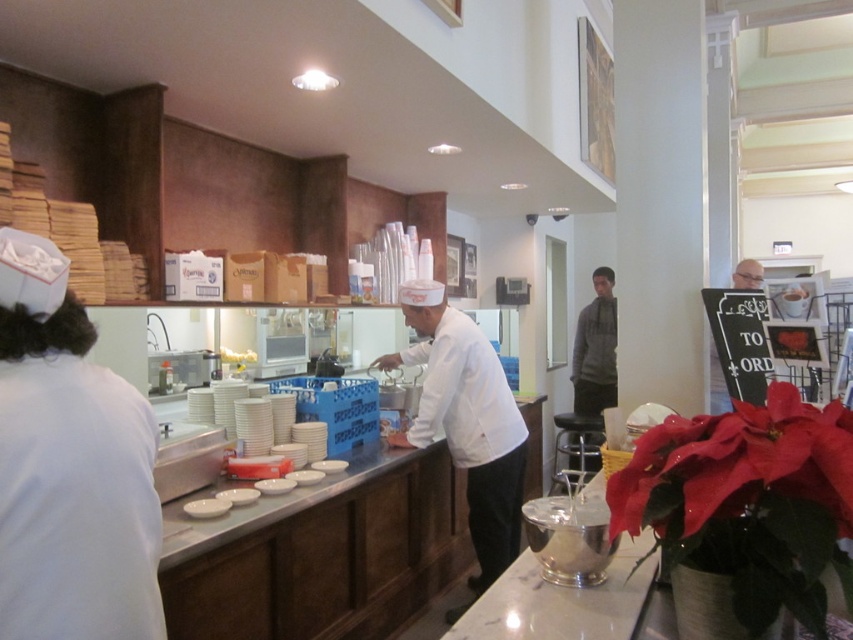
Question: Is white matte chef hat at center positioned at the back of white glossy counter at center?

Choices:
 (A) no
 (B) yes

Answer: (B)

Question: Does white glossy counter at center have a larger size compared to black leather stool at center?

Choices:
 (A) yes
 (B) no

Answer: (A)

Question: Which object is farther from the camera taking this photo?

Choices:
 (A) red velvet poinsettia at lower right
 (B) white fabric chef hat at left
 (C) smooth bald head at upper right

Answer: (C)

Question: Which point is closer to the camera?

Choices:
 (A) (514, 429)
 (B) (15, 228)
 (C) (579, 442)
 (D) (726, 486)

Answer: (D)

Question: Considering the relative positions of white fabric chef hat at left and white glossy counter at center in the image provided, where is white fabric chef hat at left located with respect to white glossy counter at center?

Choices:
 (A) right
 (B) left

Answer: (B)

Question: Among these points, which one is nearest to the camera?

Choices:
 (A) (44, 467)
 (B) (416, 420)

Answer: (A)